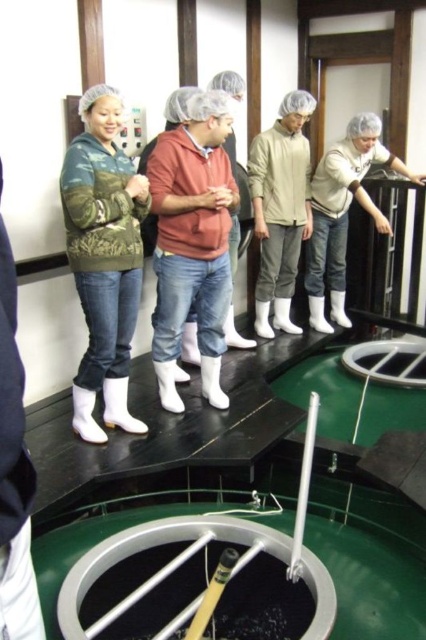
You are a tour guide at the brewery and need to point out the two jackets worn by participants. Which jacket, the matte beige jacket at center or the white matte jacket at upper center, is covering part of the other?

The matte beige jacket at center is positioned over the white matte jacket at upper center, so it is covering part of it.

You are a tour guide at the brewery and need to point out two specific points on the fermentation tanks. The first point is at coordinates point (x=308, y=163) and the second is at point (x=373, y=220). Which of these two points is closer to the visitors standing at the front of the platform?

Point (x=308, y=163) is in front of point (x=373, y=220), so it is closer to the visitors standing at the front of the platform.